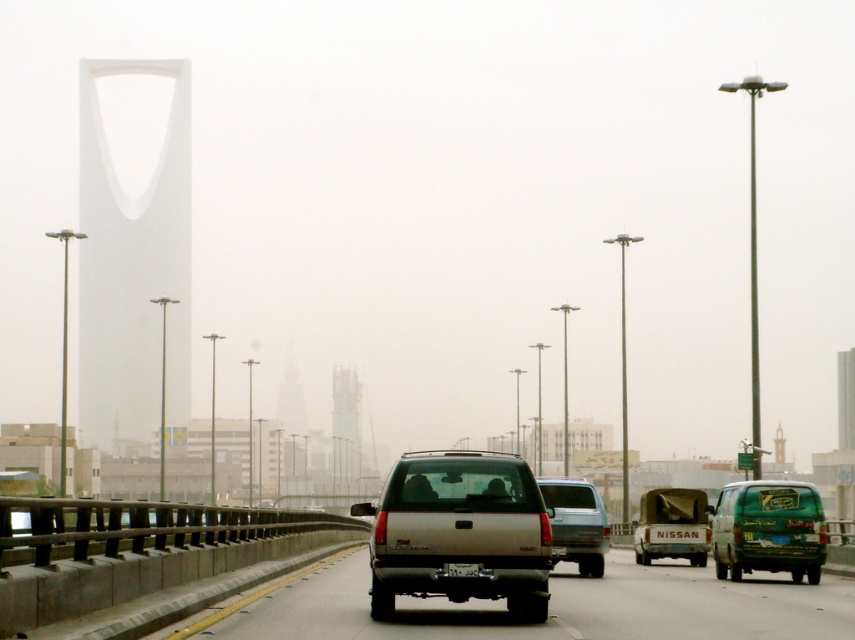
You are a traffic camera installed above the highway. You need to capture the license plate of the satin silver suv at center. Given that the black plastic license plate at center is partially visible, will the camera be able to capture the entire license plate?

The satin silver suv at center has a larger size compared to black plastic license plate at center, so the camera should be able to capture the entire license plate as it is part of the larger vehicle.

You are a traffic officer observing the highway. You notice the satin silver suv at center and the black plastic license plate at center. Which object is positioned higher in the image?

The satin silver suv at center is located above the black plastic license plate at center, so it is positioned higher in the image.